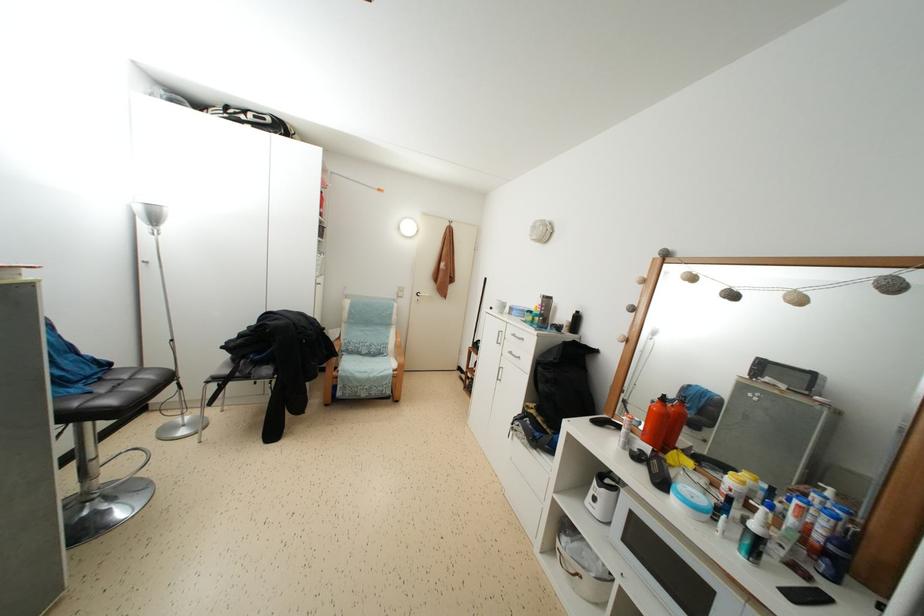
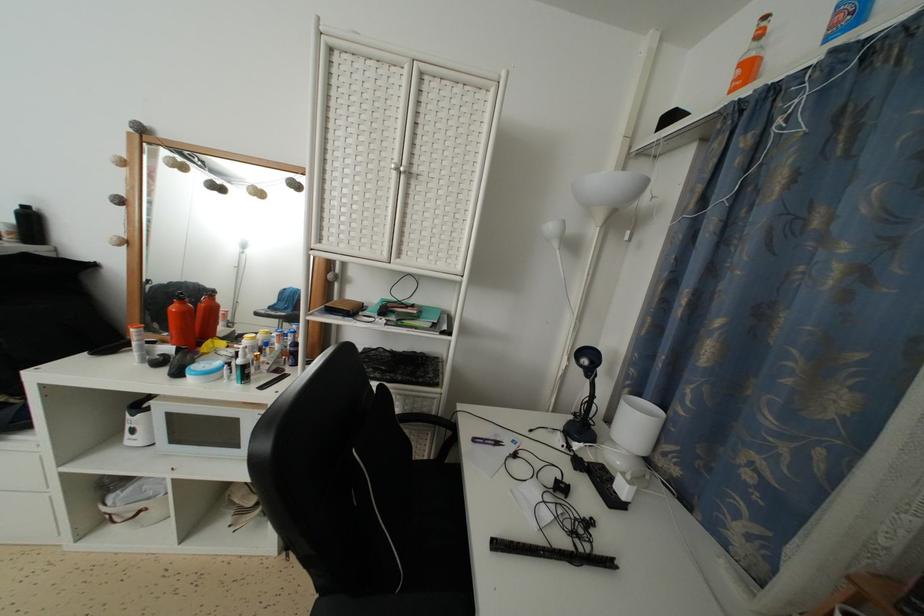
In the second image, find the point that corresponds to point (675, 472) in the first image.

(209, 360)